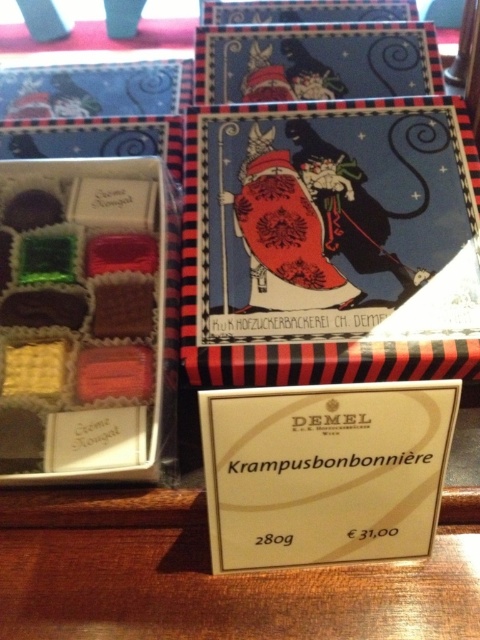
Looking at this image, can you confirm if matte red box at upper center is positioned to the left of matte chocolate box at center?

Incorrect, matte red box at upper center is not on the left side of matte chocolate box at center.

Measure the distance between matte red box at upper center and matte chocolate box at center.

matte red box at upper center and matte chocolate box at center are 22.09 centimeters apart from each other.

At what (x,y) coordinates should I click in order to perform the action: click on matte red box at upper center. Please return your answer as a coordinate pair (x, y). The height and width of the screenshot is (640, 480). Looking at the image, I should click on (321, 236).